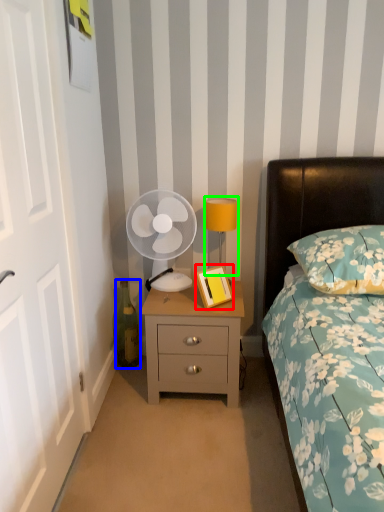
Question: Considering the real-world distances, which object is closest to picture frame (highlighted by a red box)? bottle (highlighted by a blue box) or bedside lamp (highlighted by a green box).

Choices:
 (A) bottle
 (B) bedside lamp

Answer: (B)